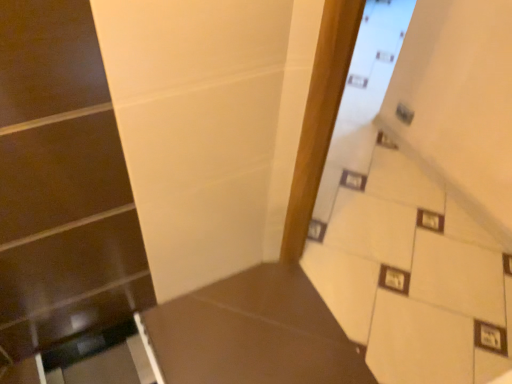
Image resolution: width=512 pixels, height=384 pixels. In order to click on brown matte table at lower left in this screenshot , I will do `click(253, 333)`.

Measure the distance between brown matte table at lower left and camera.

brown matte table at lower left and camera are 4.21 feet apart.

The image size is (512, 384). What do you see at coordinates (253, 333) in the screenshot? I see `brown matte table at lower left` at bounding box center [253, 333].

Where is `white tile stairwell at upper right`? white tile stairwell at upper right is located at coordinates (413, 277).

What do you see at coordinates (413, 277) in the screenshot?
I see `white tile stairwell at upper right` at bounding box center [413, 277].

Identify the location of brown matte table at lower left. This screenshot has height=384, width=512. (253, 333).

Between white tile stairwell at upper right and brown matte table at lower left, which one appears on the right side from the viewer's perspective?

From the viewer's perspective, white tile stairwell at upper right appears more on the right side.

Is the position of white tile stairwell at upper right less distant than that of brown matte table at lower left?

That is True.

Does point (467, 348) appear closer or farther from the camera than point (276, 272)?

Clearly, point (467, 348) is closer to the camera than point (276, 272).

From the image's perspective, which object appears higher, white tile stairwell at upper right or brown matte table at lower left?

From the image's view, white tile stairwell at upper right is above.

From a real-world perspective, is white tile stairwell at upper right located beneath brown matte table at lower left?

Answer: No, from a real-world perspective, white tile stairwell at upper right is not beneath brown matte table at lower left.

Is white tile stairwell at upper right wider or thinner than brown matte table at lower left?

Clearly, white tile stairwell at upper right has less width compared to brown matte table at lower left.

Looking at this image, who is taller, white tile stairwell at upper right or brown matte table at lower left?

white tile stairwell at upper right.

Can you confirm if white tile stairwell at upper right is smaller than brown matte table at lower left?

No.

Is brown matte table at lower left completely or partially inside white tile stairwell at upper right?

No, white tile stairwell at upper right does not contain brown matte table at lower left.

Is white tile stairwell at upper right not near brown matte table at lower left?

No, white tile stairwell at upper right is not far away from brown matte table at lower left.

Is white tile stairwell at upper right positioned with its back to brown matte table at lower left?

No, white tile stairwell at upper right's orientation is not away from brown matte table at lower left.

Can you tell me how much white tile stairwell at upper right and brown matte table at lower left differ in facing direction?

The angle between the facing direction of white tile stairwell at upper right and the facing direction of brown matte table at lower left is 180 degrees.

Measure the distance between white tile stairwell at upper right and brown matte table at lower left.

They are 13.37 inches apart.

The width and height of the screenshot is (512, 384). There is a brown matte table at lower left. What are the coordinates of `stairwell above it (from a real-world perspective)` in the screenshot? It's located at (413, 277).

Consider the image. Based on their positions, is brown matte table at lower left located to the left or right of white tile stairwell at upper right?

Clearly, brown matte table at lower left is on the left of white tile stairwell at upper right in the image.

Does brown matte table at lower left lie in front of white tile stairwell at upper right?

That is False.

Is point (211, 368) positioned in front of point (388, 186)?

Yes, it is.

From the image's perspective, which is above, brown matte table at lower left or white tile stairwell at upper right?

white tile stairwell at upper right, from the image's perspective.

Based on the photo, from a real-world perspective, is brown matte table at lower left positioned under white tile stairwell at upper right based on gravity?

Yes.

Which object is thinner, brown matte table at lower left or white tile stairwell at upper right?

white tile stairwell at upper right is thinner.

Which of these two, brown matte table at lower left or white tile stairwell at upper right, stands shorter?

Standing shorter between the two is brown matte table at lower left.

Between brown matte table at lower left and white tile stairwell at upper right, which one has smaller size?

With smaller size is brown matte table at lower left.

Is white tile stairwell at upper right a part of brown matte table at lower left?

No, brown matte table at lower left does not contain white tile stairwell at upper right.

Are brown matte table at lower left and white tile stairwell at upper right located far from each other?

brown matte table at lower left is actually quite close to white tile stairwell at upper right.

Does brown matte table at lower left turn towards white tile stairwell at upper right?

Yes.

Locate an element on the screen. table on the left of white tile stairwell at upper right is located at coordinates (253, 333).

Locate an element on the screen. The width and height of the screenshot is (512, 384). table behind the white tile stairwell at upper right is located at coordinates (253, 333).

This screenshot has height=384, width=512. I want to click on stairwell in front of the brown matte table at lower left, so click(413, 277).